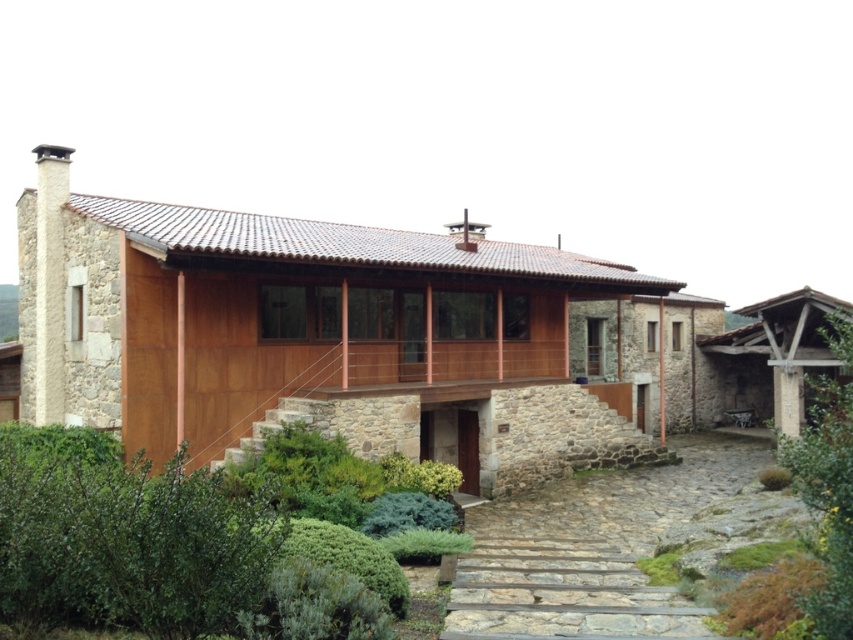
Question: Which point is closer to the camera taking this photo?

Choices:
 (A) [x=630, y=611]
 (B) [x=364, y=588]

Answer: (B)

Question: Can you confirm if green leafy hedge at center is positioned to the right of gray stone steps at center?

Choices:
 (A) yes
 (B) no

Answer: (B)

Question: Does green leafy hedge at center have a lesser width compared to gray stone steps at center?

Choices:
 (A) yes
 (B) no

Answer: (A)

Question: Does green leafy hedge at center have a larger size compared to gray stone steps at center?

Choices:
 (A) yes
 (B) no

Answer: (B)

Question: Which point is closer to the camera?

Choices:
 (A) green leafy hedge at center
 (B) gray stone steps at center

Answer: (A)